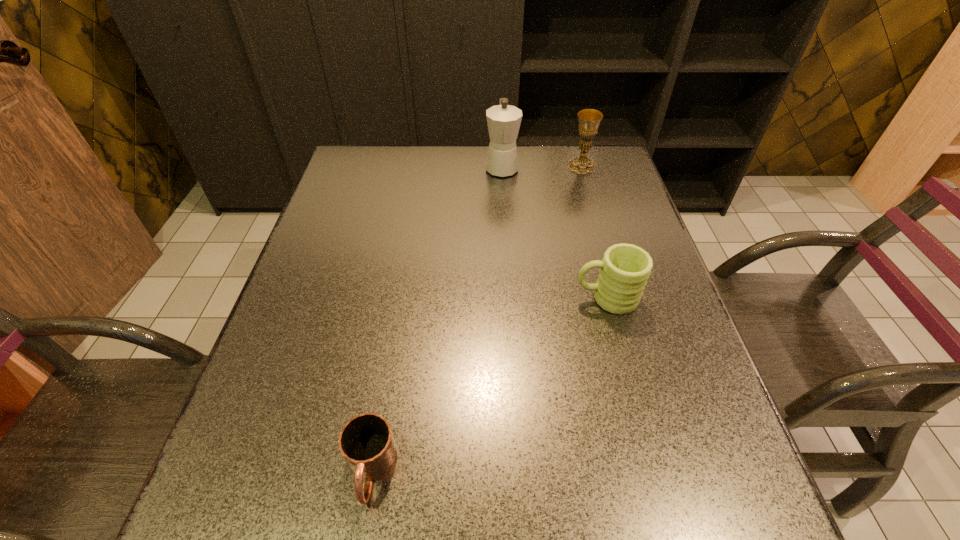
Image resolution: width=960 pixels, height=540 pixels. I want to click on vacant region located 0.260m on the side of the right mug with the handle, so click(x=459, y=298).

At what (x,y) coordinates should I click in order to perform the action: click on free spot located on the side of the right mug with the handle. Please return your answer as a coordinate pair (x, y). The height and width of the screenshot is (540, 960). Looking at the image, I should click on (406, 298).

Identify the location of coffeepot that is at the far edge. This screenshot has width=960, height=540. (503, 120).

Locate an element on the screen. The width and height of the screenshot is (960, 540). chalice that is at the far edge is located at coordinates (589, 119).

I want to click on object present at the near edge, so click(x=366, y=442).

Identify the location of chalice located at the right edge. (589, 119).

You are a GUI agent. You are given a task and a screenshot of the screen. Output one action in this format:
    pyautogui.click(x=<x>, y=<y>)
    Task: Click on the mug at the right edge
    
    Given the screenshot: What is the action you would take?
    pyautogui.click(x=624, y=270)

At what (x,y) coordinates should I click in order to perform the action: click on object located at the far right corner. Please return your answer as a coordinate pair (x, y). Looking at the image, I should click on (589, 119).

In order to click on vacant region at the far edge of the desktop in this screenshot , I will do `click(492, 185)`.

The image size is (960, 540). I want to click on free space at the near edge of the desktop, so click(362, 506).